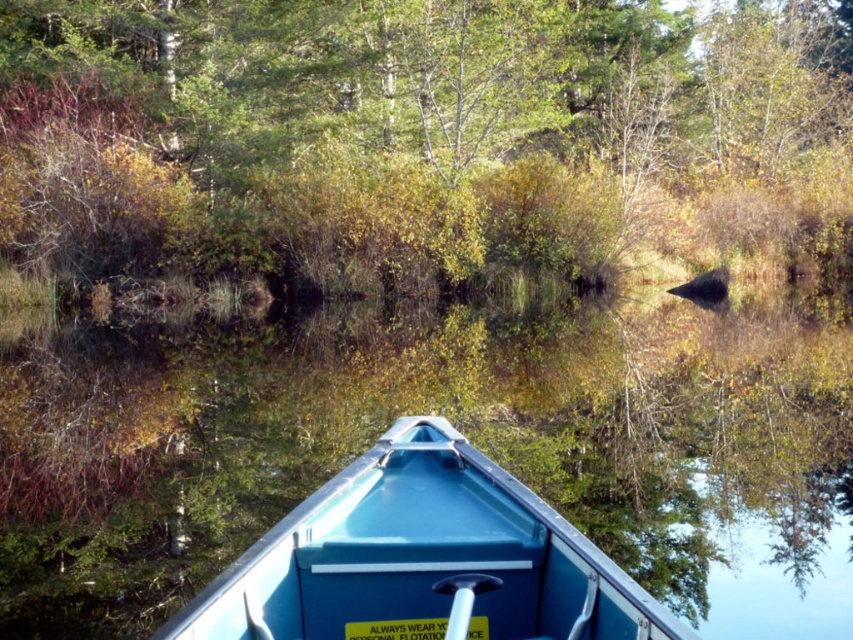
Question: Which of the following is the closest to the observer?

Choices:
 (A) (492, 468)
 (B) (538, 49)

Answer: (A)

Question: Among these objects, which one is nearest to the camera?

Choices:
 (A) green leafy tree at upper center
 (B) blue plastic boat at center

Answer: (B)

Question: From the image, what is the correct spatial relationship of green leafy tree at upper center in relation to blue plastic boat at center?

Choices:
 (A) above
 (B) below

Answer: (A)

Question: Is green leafy tree at upper center bigger than blue plastic boat at center?

Choices:
 (A) yes
 (B) no

Answer: (A)

Question: Which point is closer to the camera?

Choices:
 (A) (665, 637)
 (B) (4, 22)

Answer: (A)

Question: In this image, where is green leafy tree at upper center located relative to blue plastic boat at center?

Choices:
 (A) left
 (B) right

Answer: (B)